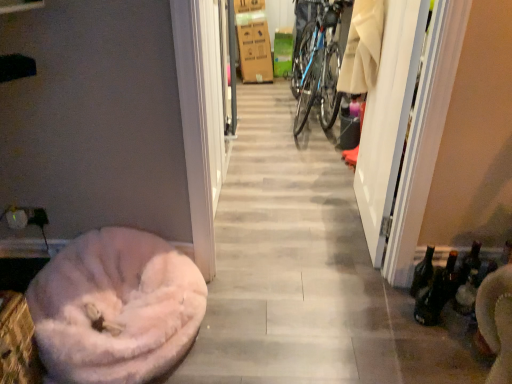
Identify the location of free space to the left of white glossy screen door at right. The height and width of the screenshot is (384, 512). (304, 220).